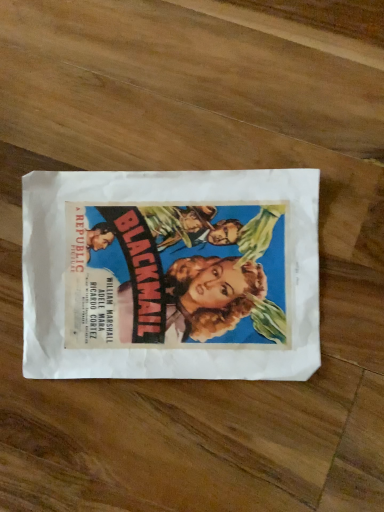
Question: Should I look upward or downward to see vintage paper poster at center?

Choices:
 (A) up
 (B) down

Answer: (B)